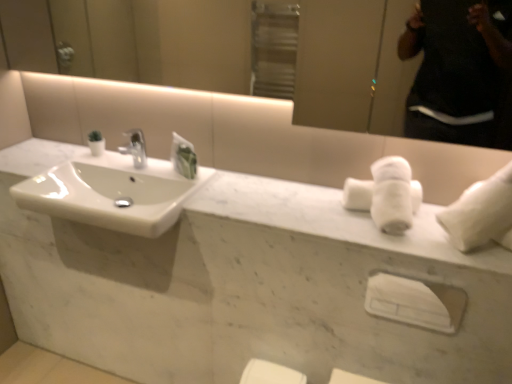
Question: Can you confirm if white glossy sink at left is wider than white fluffy bath towel at upper right, the 1th bath towel viewed from the left?

Choices:
 (A) no
 (B) yes

Answer: (B)

Question: From the image's perspective, is white glossy sink at left over white fluffy bath towel at upper right, the 1th bath towel viewed from the left?

Choices:
 (A) no
 (B) yes

Answer: (A)

Question: Is white glossy sink at left outside white fluffy bath towel at upper right, marked as the 2th bath towel in a right-to-left arrangement?

Choices:
 (A) yes
 (B) no

Answer: (A)

Question: Is white glossy sink at left oriented away from white fluffy bath towel at upper right, marked as the 2th bath towel in a right-to-left arrangement?

Choices:
 (A) yes
 (B) no

Answer: (B)

Question: Is white glossy sink at left aimed at white fluffy bath towel at upper right, the 1th bath towel viewed from the left?

Choices:
 (A) no
 (B) yes

Answer: (A)

Question: Can you confirm if white glossy sink at left is shorter than white fluffy bath towel at upper right, marked as the 2th bath towel in a right-to-left arrangement?

Choices:
 (A) no
 (B) yes

Answer: (B)

Question: Does white fluffy bath towel at upper right, the 1th bath towel viewed from the left, appear on the right side of white glossy sink at left?

Choices:
 (A) yes
 (B) no

Answer: (A)

Question: Considering the relative sizes of white fluffy bath towel at upper right, marked as the 2th bath towel in a right-to-left arrangement, and white glossy sink at left in the image provided, is white fluffy bath towel at upper right, marked as the 2th bath towel in a right-to-left arrangement, wider than white glossy sink at left?

Choices:
 (A) yes
 (B) no

Answer: (B)

Question: Does white fluffy bath towel at upper right, marked as the 2th bath towel in a right-to-left arrangement, have a greater height compared to white glossy sink at left?

Choices:
 (A) no
 (B) yes

Answer: (B)

Question: Does white fluffy bath towel at upper right, the 1th bath towel viewed from the left, appear on the left side of white glossy sink at left?

Choices:
 (A) yes
 (B) no

Answer: (B)

Question: Is white fluffy bath towel at upper right, the 1th bath towel viewed from the left, smaller than white glossy sink at left?

Choices:
 (A) no
 (B) yes

Answer: (B)

Question: Is white fluffy bath towel at upper right, marked as the 2th bath towel in a right-to-left arrangement, located outside white glossy sink at left?

Choices:
 (A) yes
 (B) no

Answer: (A)

Question: Is white glossy sink at left looking in the opposite direction of white plastic towel bar at center?

Choices:
 (A) no
 (B) yes

Answer: (A)